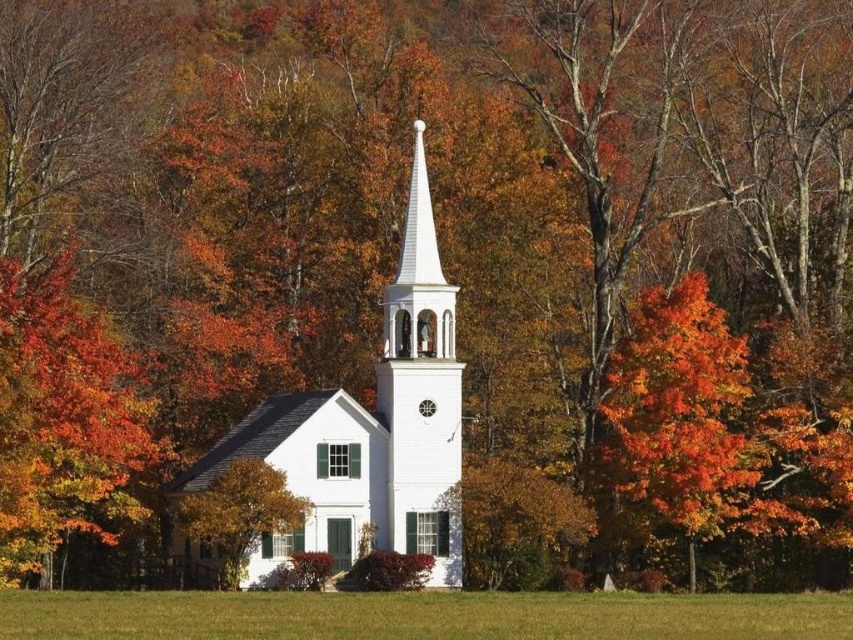
Which is more to the right, vivid orange leaves at right or white smooth steeple at center?

vivid orange leaves at right

Does vivid orange leaves at right appear on the right side of white smooth steeple at center?

Yes, vivid orange leaves at right is to the right of white smooth steeple at center.

Image resolution: width=853 pixels, height=640 pixels. I want to click on vivid orange leaves at right, so click(x=679, y=416).

Is point (689, 506) in front of point (248, 525)?

No, (689, 506) is behind (248, 525).

Locate an element on the screen. vivid orange leaves at right is located at coordinates (679, 416).

Identify the location of vivid orange leaves at right. (679, 416).

Does point (105, 333) come farther from viewer compared to point (225, 532)?

Yes, point (105, 333) is farther from viewer.

Between point (0, 440) and point (260, 536), which one is positioned in front?

Point (0, 440) is in front.

Image resolution: width=853 pixels, height=640 pixels. I want to click on shiny orange leaves at left, so click(x=64, y=419).

At what (x,y) coordinates should I click in order to perform the action: click on shiny orange leaves at left. Please return your answer as a coordinate pair (x, y). Looking at the image, I should click on (64, 419).